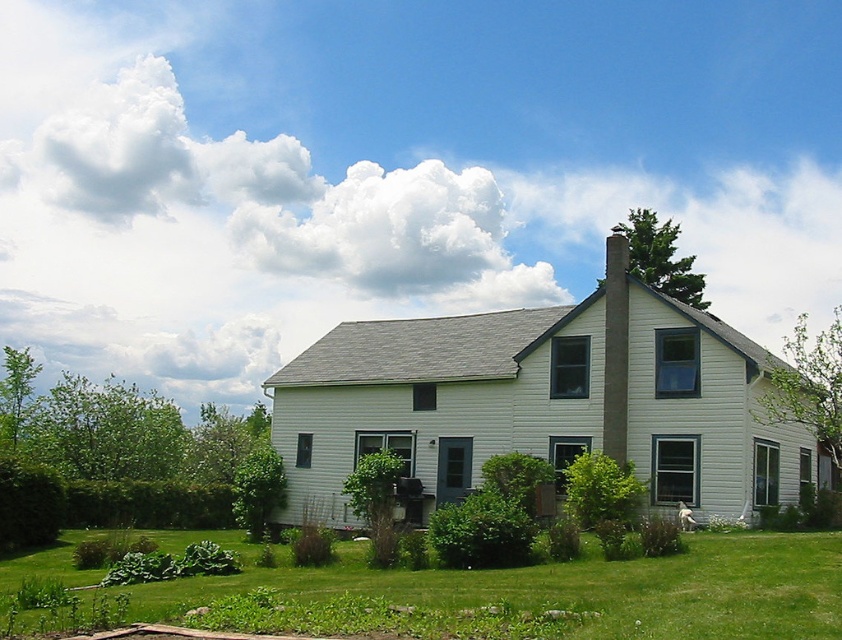
Question: Is green grass at lower center smaller than smooth concrete chimney at center?

Choices:
 (A) no
 (B) yes

Answer: (A)

Question: From the image, what is the correct spatial relationship of green grass at lower center in relation to smooth concrete chimney at center?

Choices:
 (A) below
 (B) above

Answer: (A)

Question: Which point is farther from the camera taking this photo?

Choices:
 (A) (606, 372)
 (B) (711, 588)

Answer: (A)

Question: In this image, where is green grass at lower center located relative to smooth concrete chimney at center?

Choices:
 (A) above
 (B) below

Answer: (B)

Question: Which point is closer to the camera?

Choices:
 (A) smooth concrete chimney at center
 (B) green grass at lower center

Answer: (B)